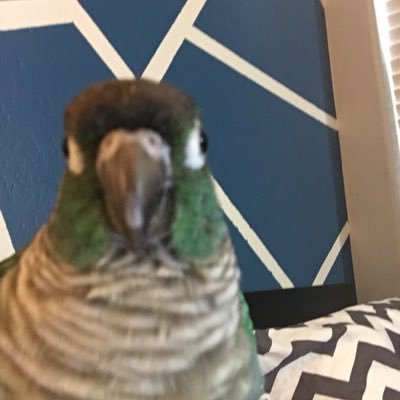
Where is `wall`? This screenshot has width=400, height=400. wall is located at coordinates (288, 155).